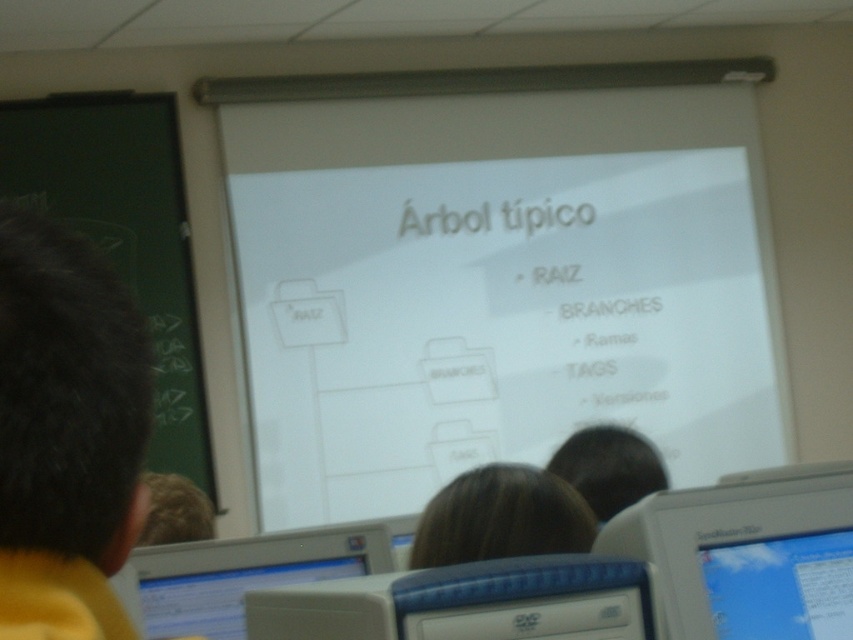
In the scene shown: Is white plastic computer monitor at lower left smaller than brown hair at center?

No.

Does white plastic computer monitor at lower left have a lesser width compared to brown hair at center?

No, white plastic computer monitor at lower left is not thinner than brown hair at center.

This screenshot has width=853, height=640. What are the coordinates of `white plastic computer monitor at lower left` in the screenshot? It's located at (241, 573).

Which is in front, point (442, 516) or point (581, 435)?

Positioned in front is point (442, 516).

Can you confirm if brown hair at center is taller than dark brown hair at lower center?

In fact, brown hair at center may be shorter than dark brown hair at lower center.

Is point (579, 502) less distant than point (654, 468)?

Yes.

At what (x,y) coordinates should I click in order to perform the action: click on brown hair at center. Please return your answer as a coordinate pair (x, y). This screenshot has width=853, height=640. Looking at the image, I should click on (502, 516).

Can you confirm if green chalkboard at left is positioned below white plastic computer monitor at lower left?

Actually, green chalkboard at left is above white plastic computer monitor at lower left.

Who is higher up, green chalkboard at left or white plastic computer monitor at lower left?

green chalkboard at left

Between point (166, 148) and point (264, 566), which one is positioned in front?

Point (264, 566) is in front.

Where is `green chalkboard at left`? green chalkboard at left is located at coordinates (125, 234).